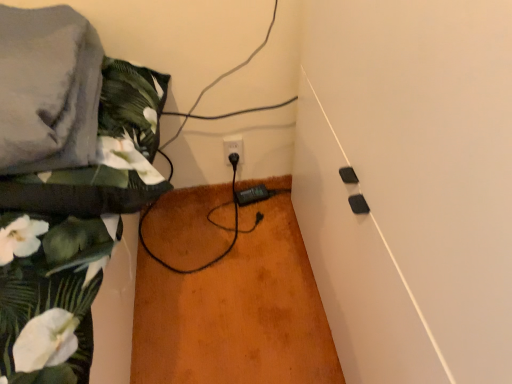
Question: Does black plastic socket at center turn towards floral fabric at left?

Choices:
 (A) no
 (B) yes

Answer: (A)

Question: Does black plastic socket at center appear on the left side of floral fabric at left?

Choices:
 (A) yes
 (B) no

Answer: (B)

Question: Does black plastic socket at center lie behind floral fabric at left?

Choices:
 (A) no
 (B) yes

Answer: (B)

Question: Is black plastic socket at center oriented away from floral fabric at left?

Choices:
 (A) no
 (B) yes

Answer: (A)

Question: From the image's perspective, is black plastic socket at center below floral fabric at left?

Choices:
 (A) yes
 (B) no

Answer: (A)

Question: Considering the positions of floral fabric at left and gray fabric at upper left in the image, is floral fabric at left taller or shorter than gray fabric at upper left?

Choices:
 (A) short
 (B) tall

Answer: (B)

Question: Based on their sizes in the image, would you say floral fabric at left is bigger or smaller than gray fabric at upper left?

Choices:
 (A) small
 (B) big

Answer: (B)

Question: Is floral fabric at left situated inside gray fabric at upper left or outside?

Choices:
 (A) outside
 (B) inside

Answer: (A)

Question: Considering the positions of floral fabric at left and gray fabric at upper left in the image, is floral fabric at left wider or thinner than gray fabric at upper left?

Choices:
 (A) thin
 (B) wide

Answer: (B)

Question: From the image's perspective, is gray fabric at upper left located above or below floral fabric at left?

Choices:
 (A) above
 (B) below

Answer: (A)

Question: Considering the positions of gray fabric at upper left and floral fabric at left in the image, is gray fabric at upper left wider or thinner than floral fabric at left?

Choices:
 (A) wide
 (B) thin

Answer: (B)

Question: From a real-world perspective, is gray fabric at upper left positioned above or below floral fabric at left?

Choices:
 (A) above
 (B) below

Answer: (A)

Question: Considering the positions of point (15, 139) and point (11, 23), is point (15, 139) closer or farther from the camera than point (11, 23)?

Choices:
 (A) farther
 (B) closer

Answer: (B)

Question: Is black plastic socket at center bigger or smaller than gray fabric at upper left?

Choices:
 (A) small
 (B) big

Answer: (A)

Question: From the image's perspective, is black plastic socket at center above or below gray fabric at upper left?

Choices:
 (A) above
 (B) below

Answer: (B)